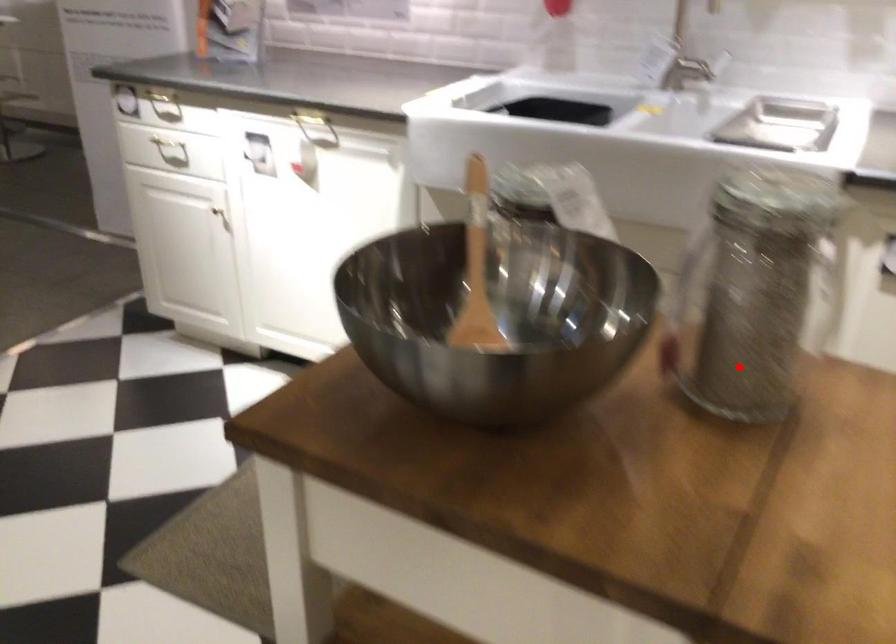
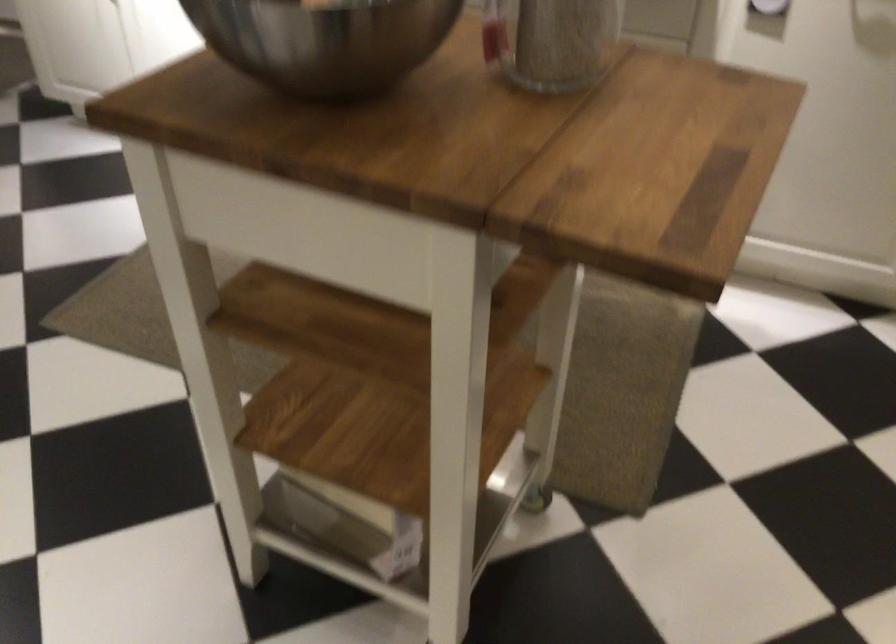
Question: I am providing you with two images of the same scene from different viewpoints. In image1, a red point is highlighted. Considering the same 3D point in image2, which of the following is correct?

Choices:
 (A) It is closer
 (B) It is farther

Answer: (B)